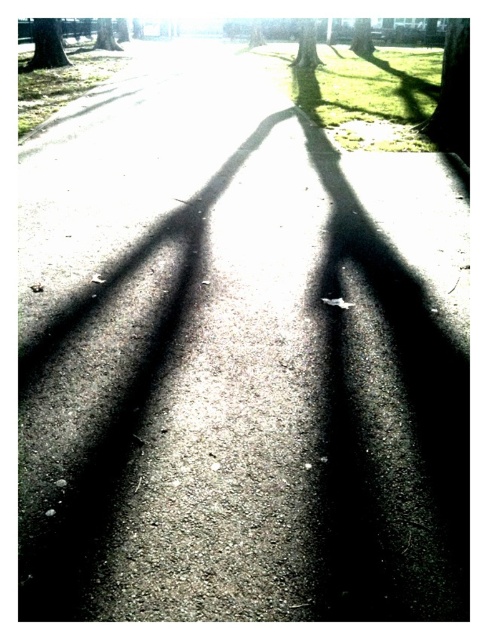
Between green rough bark tree at upper right and green textured tree trunk at upper left, which one appears on the left side from the viewer's perspective?

green textured tree trunk at upper left is more to the left.

Where is `green rough bark tree at upper right`? Image resolution: width=488 pixels, height=640 pixels. green rough bark tree at upper right is located at coordinates (452, 93).

Locate an element on the screen. The width and height of the screenshot is (488, 640). green rough bark tree at upper right is located at coordinates (452, 93).

This screenshot has width=488, height=640. Identify the location of green rough bark tree at upper right. (452, 93).

Describe the element at coordinates (306, 45) in the screenshot. This screenshot has height=640, width=488. I see `green textured tree at upper center` at that location.

The image size is (488, 640). What are the coordinates of `green textured tree at upper center` in the screenshot? It's located at (306, 45).

Is green textured tree trunk at upper left shorter than smooth bark tree at upper center?

Incorrect, green textured tree trunk at upper left's height does not fall short of smooth bark tree at upper center's.

Can you confirm if green textured tree trunk at upper left is bigger than smooth bark tree at upper center?

Yes.

This screenshot has width=488, height=640. I want to click on green textured tree trunk at upper left, so click(x=46, y=44).